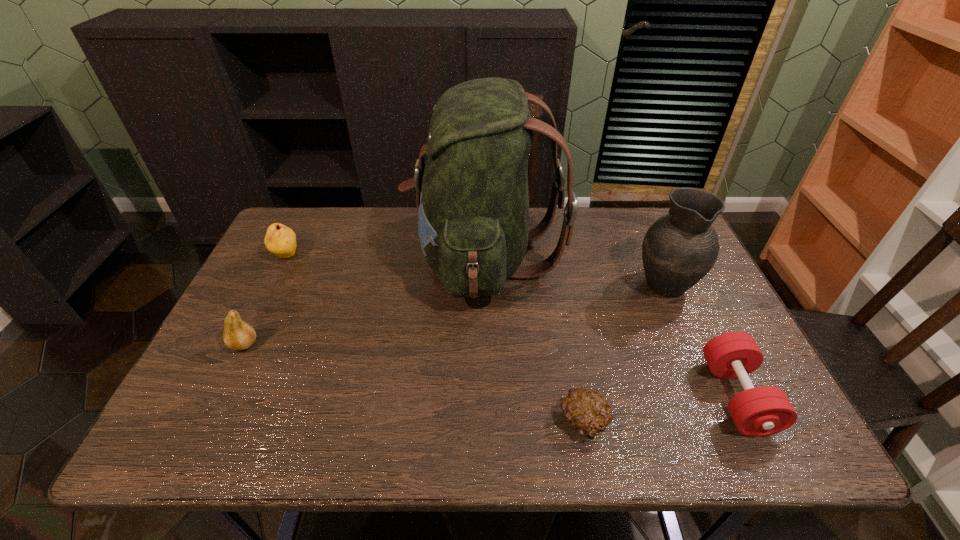
Find the location of a particular element. This screenshot has height=540, width=960. blank area in the image that satisfies the following two spatial constraints: 1. on the back side of the muffin; 2. on the open flap of the backpack is located at coordinates (553, 258).

This screenshot has height=540, width=960. What are the coordinates of `free point that satisfies the following two spatial constraints: 1. on the open flap of the backpack; 2. on the back side of the shortest object` in the screenshot? It's located at (487, 422).

In order to click on free space that satisfies the following two spatial constraints: 1. on the open flap of the muffin; 2. on the right side of the backpack in this screenshot , I will do `click(487, 422)`.